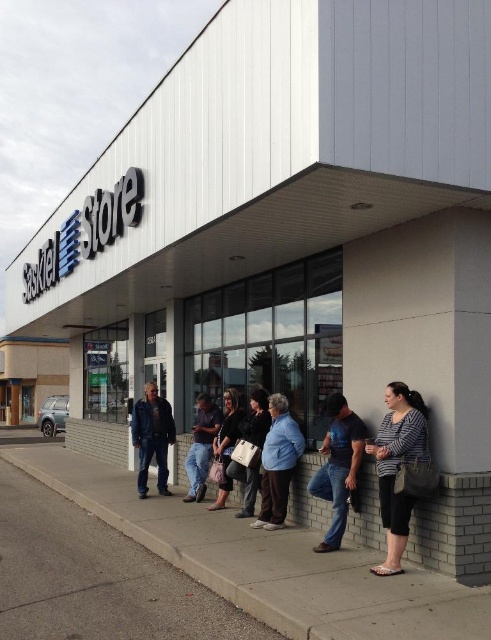
You are standing at point (233,394) and want to walk to the SaskTel Store entrance. There is a person at point (321,550) blocking your path. Can you walk around them to reach the store?

Point (321,550) is in front of point (233,394), so you can walk around the person at point (321,550) to reach the SaskTel Store entrance since they are in front of you and not directly blocking the path.

You are a store employee who needs to hand out a flyer to the person wearing the blue denim jacket at center and the black leather jacket at center. Which jacket should you approach first if you want to give the smaller one the flyer first?

The blue denim jacket at center is smaller than the black leather jacket at center, so you should approach the person wearing the blue denim jacket at center first to give them the flyer before the other.